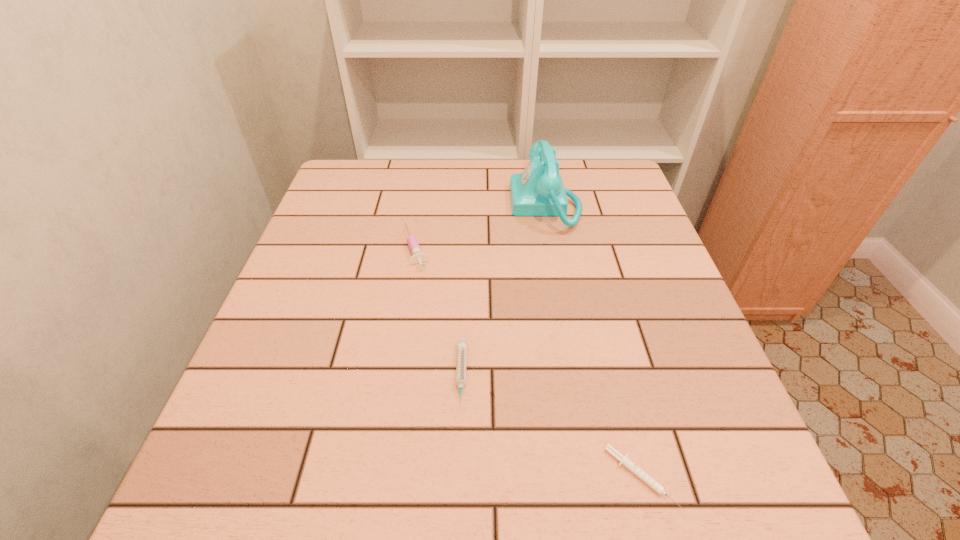
I want to click on vacant region that satisfies the following two spatial constraints: 1. on the dial of the tallest object; 2. at the needle end of the second farthest syringe, so click(x=577, y=376).

Find the location of a particular element. Image resolution: width=960 pixels, height=540 pixels. free point that satisfies the following two spatial constraints: 1. at the needle end of the third tallest object; 2. on the right side of the nearest object is located at coordinates (458, 477).

Locate an element on the screen. vacant position in the image that satisfies the following two spatial constraints: 1. on the dial of the telephone; 2. at the needle end of the second nearest syringe is located at coordinates (577, 376).

Find the location of a particular element. The height and width of the screenshot is (540, 960). vacant position in the image that satisfies the following two spatial constraints: 1. on the dial of the tallest object; 2. at the needle end of the second nearest object is located at coordinates (577, 376).

The height and width of the screenshot is (540, 960). In order to click on vacant area that satisfies the following two spatial constraints: 1. on the front side of the leftmost object; 2. on the right side of the shortest object in this screenshot , I will do tap(379, 477).

You are a GUI agent. You are given a task and a screenshot of the screen. Output one action in this format:
    pyautogui.click(x=<x>, y=<y>)
    Task: Click on the vacant region that satisfies the following two spatial constraints: 1. on the dial of the telephone; 2. at the needle end of the second syringe from right to left
    Image resolution: width=960 pixels, height=540 pixels.
    Given the screenshot: What is the action you would take?
    pyautogui.click(x=577, y=376)

At what (x,y) coordinates should I click in order to perform the action: click on free space that satisfies the following two spatial constraints: 1. on the front side of the nearest syringe; 2. on the right side of the leftmost object. Please return your answer as a coordinate pair (x, y). Image resolution: width=960 pixels, height=540 pixels. Looking at the image, I should click on (379, 477).